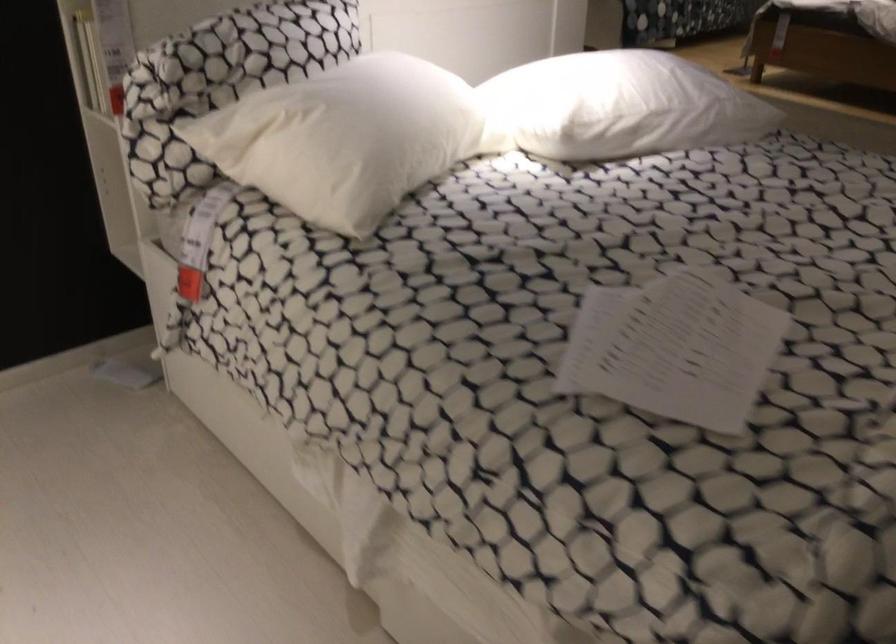
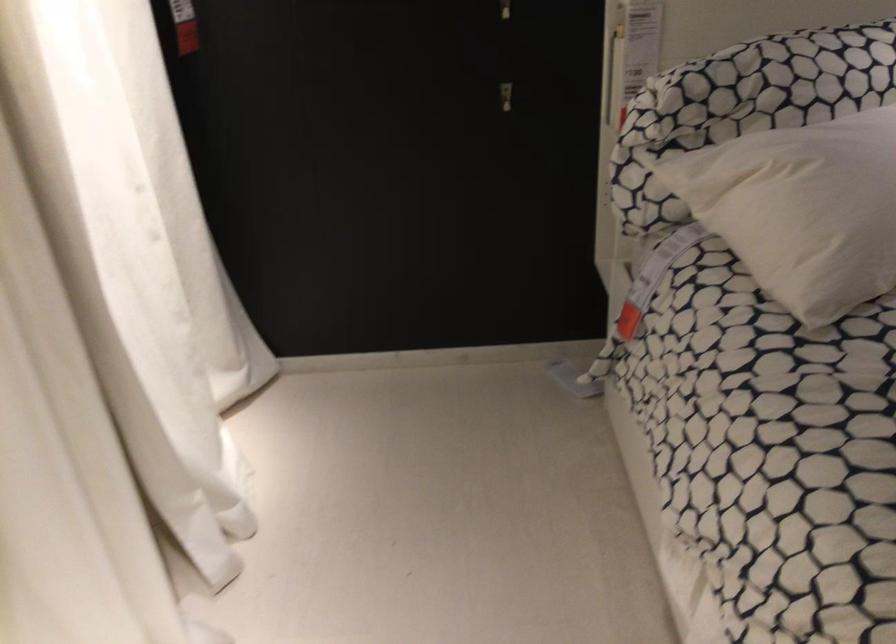
Find the pixel in the second image that matches (x=330, y=146) in the first image.

(802, 209)